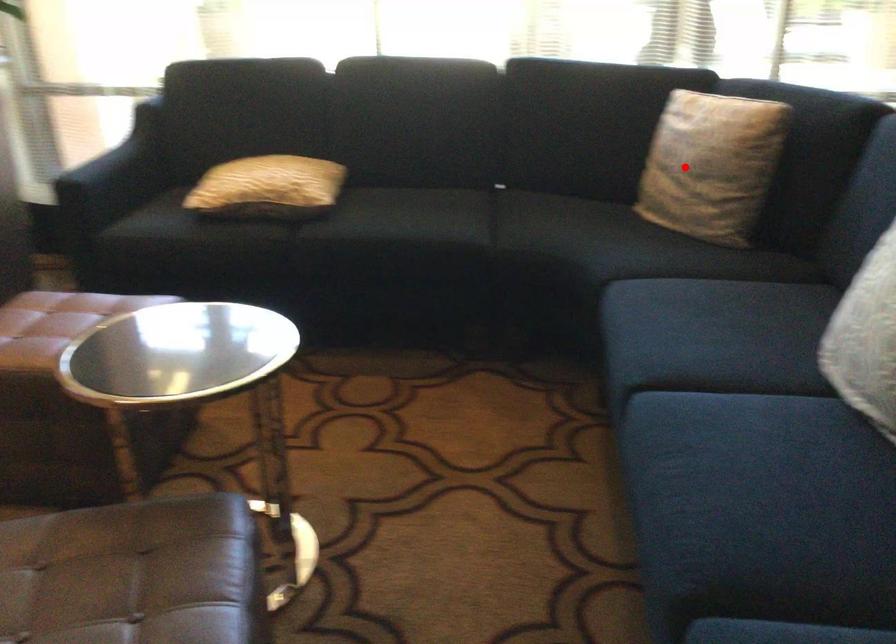
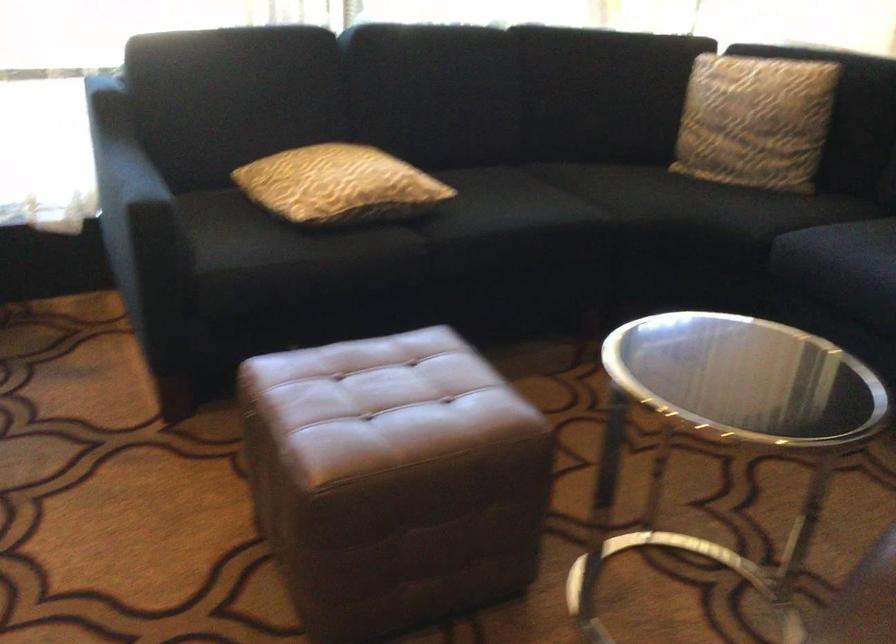
Question: I am providing you with two images of the same scene from different viewpoints. A red point is marked on the first image. Is the red point's position out of view in image 2?

Choices:
 (A) Yes
 (B) No

Answer: (B)